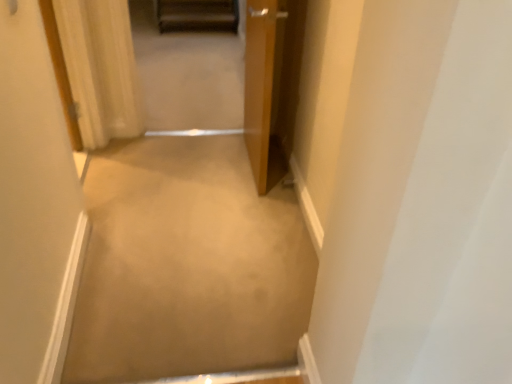
Question: Is beige carpet at center placed right next to wooden door at upper left?

Choices:
 (A) no
 (B) yes

Answer: (A)

Question: Is beige carpet at center in front of wooden door at upper left?

Choices:
 (A) no
 (B) yes

Answer: (B)

Question: Considering the relative sizes of beige carpet at center and wooden door at upper left in the image provided, is beige carpet at center wider than wooden door at upper left?

Choices:
 (A) no
 (B) yes

Answer: (A)

Question: Is beige carpet at center facing towards wooden door at upper left?

Choices:
 (A) yes
 (B) no

Answer: (A)

Question: From the image's perspective, would you say beige carpet at center is positioned over wooden door at upper left?

Choices:
 (A) yes
 (B) no

Answer: (B)

Question: Considering the positions of point (280, 301) and point (248, 109), is point (280, 301) closer or farther from the camera than point (248, 109)?

Choices:
 (A) farther
 (B) closer

Answer: (B)

Question: In terms of width, does beige carpet at center look wider or thinner when compared to wooden door at center, positioned as the second door in left-to-right order?

Choices:
 (A) wide
 (B) thin

Answer: (A)

Question: Considering the positions of beige carpet at center and wooden door at center, positioned as the second door in left-to-right order, in the image, is beige carpet at center taller or shorter than wooden door at center, positioned as the second door in left-to-right order,?

Choices:
 (A) short
 (B) tall

Answer: (A)

Question: Based on their sizes in the image, would you say beige carpet at center is bigger or smaller than wooden door at center, positioned as the second door in left-to-right order?

Choices:
 (A) big
 (B) small

Answer: (B)

Question: In terms of height, does white wood door at left, which is counted as the 2th door, starting from the right, look taller or shorter compared to wooden door at upper left?

Choices:
 (A) short
 (B) tall

Answer: (B)

Question: From the image's perspective, relative to wooden door at upper left, is white wood door at left, placed as the first door when sorted from left to right, above or below?

Choices:
 (A) below
 (B) above

Answer: (A)

Question: In the image, is white wood door at left, placed as the first door when sorted from left to right, positioned in front of or behind wooden door at upper left?

Choices:
 (A) front
 (B) behind

Answer: (A)

Question: Choose the correct answer: Is white wood door at left, which is counted as the 2th door, starting from the right, inside wooden door at upper left or outside it?

Choices:
 (A) inside
 (B) outside

Answer: (B)

Question: From a real-world perspective, relative to white wood door at left, placed as the first door when sorted from left to right, is beige carpet at center vertically above or below?

Choices:
 (A) above
 (B) below

Answer: (B)

Question: Does point (153, 291) appear closer or farther from the camera than point (72, 306)?

Choices:
 (A) closer
 (B) farther

Answer: (B)